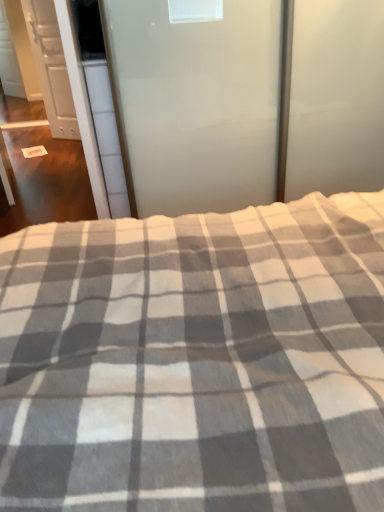
Locate an element on the screen. white glossy door at upper left, the 2th screen door viewed from the front is located at coordinates (58, 78).

What do you see at coordinates (58, 78) in the screenshot? This screenshot has height=512, width=384. I see `white glossy door at upper left, the 2th screen door viewed from the front` at bounding box center [58, 78].

What do you see at coordinates (51, 67) in the screenshot? This screenshot has height=512, width=384. I see `white matte cabinet at left` at bounding box center [51, 67].

What do you see at coordinates (199, 104) in the screenshot? This screenshot has height=512, width=384. I see `frosted glass screen door at upper center, which ranks as the second screen door in back-to-front order` at bounding box center [199, 104].

At what (x,y) coordinates should I click in order to perform the action: click on white glossy door at upper left, which is the 1th screen door from left to right. Please return your answer as a coordinate pair (x, y). Looking at the image, I should click on (58, 78).

How much distance is there between frosted glass screen door at upper center, the second screen door from the left, and white matte cabinet at left?

frosted glass screen door at upper center, the second screen door from the left, is 2.46 meters from white matte cabinet at left.

Which is correct: frosted glass screen door at upper center, the first screen door from the right, is inside white matte cabinet at left, or outside of it?

frosted glass screen door at upper center, the first screen door from the right, is located beyond the bounds of white matte cabinet at left.

Considering the sizes of frosted glass screen door at upper center, the first screen door from the right, and white matte cabinet at left in the image, is frosted glass screen door at upper center, the first screen door from the right, wider or thinner than white matte cabinet at left?

Considering their sizes, frosted glass screen door at upper center, the first screen door from the right, looks broader than white matte cabinet at left.

Is frosted glass screen door at upper center, the first screen door from the front, further to the viewer compared to white matte cabinet at left?

No, the depth of frosted glass screen door at upper center, the first screen door from the front, is less than that of white matte cabinet at left.

Which object is closer to the camera, gray checkered blanket at center or frosted glass screen door at upper center, which ranks as the second screen door in back-to-front order?

gray checkered blanket at center is closer to the camera.

Measure the distance between gray checkered blanket at center and frosted glass screen door at upper center, the first screen door from the front.

gray checkered blanket at center is 3.48 feet away from frosted glass screen door at upper center, the first screen door from the front.

Does gray checkered blanket at center turn towards frosted glass screen door at upper center, the second screen door from the left?

No, gray checkered blanket at center is not oriented towards frosted glass screen door at upper center, the second screen door from the left.

Considering the sizes of objects gray checkered blanket at center and frosted glass screen door at upper center, the first screen door from the right, in the image provided, who is shorter, gray checkered blanket at center or frosted glass screen door at upper center, the first screen door from the right,?

With less height is gray checkered blanket at center.

Does white matte cabinet at left have a lesser height compared to gray checkered blanket at center?

No, white matte cabinet at left is not shorter than gray checkered blanket at center.

How much distance is there between white matte cabinet at left and gray checkered blanket at center?

white matte cabinet at left and gray checkered blanket at center are 3.50 meters apart from each other.

Which of these two, white matte cabinet at left or gray checkered blanket at center, is thinner?

Thinner between the two is white matte cabinet at left.

Is white matte cabinet at left far away from gray checkered blanket at center?

white matte cabinet at left is positioned a significant distance from gray checkered blanket at center.

From a real-world perspective, between gray checkered blanket at center and white glossy door at upper left, the 2th screen door viewed from the front, who is vertically lower?

white glossy door at upper left, the 2th screen door viewed from the front.

Which object is thinner, gray checkered blanket at center or white glossy door at upper left, acting as the second screen door starting from the right?

white glossy door at upper left, acting as the second screen door starting from the right.

Is gray checkered blanket at center oriented towards white glossy door at upper left, the 2th screen door viewed from the front?

No, gray checkered blanket at center is not turned towards white glossy door at upper left, the 2th screen door viewed from the front.

From the image's perspective, which one is positioned higher, gray checkered blanket at center or white glossy door at upper left, the first screen door from the back?

white glossy door at upper left, the first screen door from the back, is shown above in the image.

Looking at this image, how distant is white matte cabinet at left from frosted glass screen door at upper center, the second screen door from the left?

2.46 meters.

Is white matte cabinet at left next to frosted glass screen door at upper center, which ranks as the second screen door in back-to-front order, and touching it?

white matte cabinet at left and frosted glass screen door at upper center, which ranks as the second screen door in back-to-front order, are clearly separated.

Is point (50, 83) closer or farther from the camera than point (189, 200)?

Point (50, 83) appears to be farther away from the viewer than point (189, 200).

Does white matte cabinet at left have a lesser height compared to frosted glass screen door at upper center, the first screen door from the right?

No, white matte cabinet at left is not shorter than frosted glass screen door at upper center, the first screen door from the right.

Which of these two, frosted glass screen door at upper center, the first screen door from the front, or gray checkered blanket at center, stands taller?

frosted glass screen door at upper center, the first screen door from the front, is taller.

Does frosted glass screen door at upper center, the first screen door from the front, turn towards gray checkered blanket at center?

Yes, frosted glass screen door at upper center, the first screen door from the front, is facing gray checkered blanket at center.

Is frosted glass screen door at upper center, which ranks as the second screen door in back-to-front order, positioned behind gray checkered blanket at center?

Yes, the depth of frosted glass screen door at upper center, which ranks as the second screen door in back-to-front order, is greater than that of gray checkered blanket at center.

Considering the positions of objects gray checkered blanket at center and white matte cabinet at left in the image provided, who is behind, gray checkered blanket at center or white matte cabinet at left?

white matte cabinet at left is further from the camera.

Is gray checkered blanket at center inside or outside of white matte cabinet at left?

gray checkered blanket at center is not enclosed by white matte cabinet at left.

This screenshot has width=384, height=512. Identify the location of bed above the white matte cabinet at left (from a real-world perspective). (196, 360).

Is point (377, 484) positioned before point (49, 7)?

Yes, it is in front of point (49, 7).

You are a GUI agent. You are given a task and a screenshot of the screen. Output one action in this format:
    pyautogui.click(x=<x>, y=<y>)
    Task: Click on the cabinetry lying above the frosted glass screen door at upper center, the first screen door from the right (from the image's perspective)
    
    Given the screenshot: What is the action you would take?
    pyautogui.click(x=51, y=67)

Identify the location of the 1st screen door behind the gray checkered blanket at center. (199, 104).

From the picture: Which object lies further to the anchor point gray checkered blanket at center, white matte cabinet at left or white glossy door at upper left, which is the 1th screen door from left to right?

white glossy door at upper left, which is the 1th screen door from left to right, is positioned further to the anchor gray checkered blanket at center.

Estimate the real-world distances between objects in this image. Which object is closer to white glossy door at upper left, acting as the second screen door starting from the right, white matte cabinet at left or gray checkered blanket at center?

The object closer to white glossy door at upper left, acting as the second screen door starting from the right, is white matte cabinet at left.

Considering their positions, is white glossy door at upper left, which is the 1th screen door from left to right, positioned closer to white matte cabinet at left than frosted glass screen door at upper center, the first screen door from the front?

Among the two, white glossy door at upper left, which is the 1th screen door from left to right, is located nearer to white matte cabinet at left.

Looking at the image, which one is located further to frosted glass screen door at upper center, the first screen door from the right, gray checkered blanket at center or white glossy door at upper left, acting as the second screen door starting from the right?

Among the two, white glossy door at upper left, acting as the second screen door starting from the right, is located further to frosted glass screen door at upper center, the first screen door from the right.

From the image, which object appears to be farther from gray checkered blanket at center, frosted glass screen door at upper center, the second screen door from the left, or white glossy door at upper left, acting as the second screen door starting from the right?

The object further to gray checkered blanket at center is white glossy door at upper left, acting as the second screen door starting from the right.

When comparing their distances from white matte cabinet at left, does frosted glass screen door at upper center, the first screen door from the right, or gray checkered blanket at center seem further?

gray checkered blanket at center.

Looking at the image, which one is located closer to white matte cabinet at left, frosted glass screen door at upper center, the second screen door from the left, or white glossy door at upper left, the first screen door from the back?

white glossy door at upper left, the first screen door from the back, is closer to white matte cabinet at left.

Looking at the image, which one is located further to gray checkered blanket at center, white glossy door at upper left, which is the 1th screen door from left to right, or frosted glass screen door at upper center, the first screen door from the right?

white glossy door at upper left, which is the 1th screen door from left to right, is positioned further to the anchor gray checkered blanket at center.

Locate an element on the screen. This screenshot has width=384, height=512. screen door between white matte cabinet at left and frosted glass screen door at upper center, the first screen door from the right, from left to right is located at coordinates (58, 78).

I want to click on screen door between gray checkered blanket at center and white glossy door at upper left, acting as the second screen door starting from the right, along the z-axis, so click(199, 104).